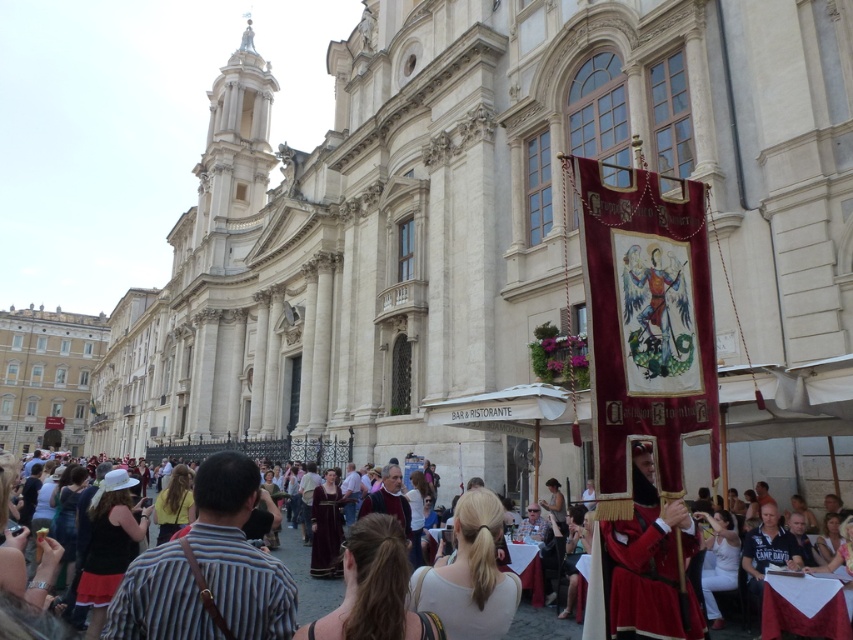
Question: Based on their relative distances, which object is nearer to the white stone church at center?

Choices:
 (A) white matte shirt at center
 (B) yellow fabric dress at center

Answer: (A)

Question: Where is white stone church at center located in relation to matte black shirt at lower left in the image?

Choices:
 (A) below
 (B) above

Answer: (B)

Question: Does white matte shirt at center appear on the right side of dark brown leather dress at center?

Choices:
 (A) yes
 (B) no

Answer: (A)

Question: Considering the real-world distances, which object is farthest from the matte black shirt at lower left?

Choices:
 (A) dark brown leather dress at center
 (B) white matte shirt at center

Answer: (B)

Question: Which point is closer to the camera taking this photo?

Choices:
 (A) (392, 632)
 (B) (480, 493)

Answer: (A)

Question: Can you confirm if dark brown leather dress at center is positioned below matte black shirt at lower left?

Choices:
 (A) yes
 (B) no

Answer: (B)